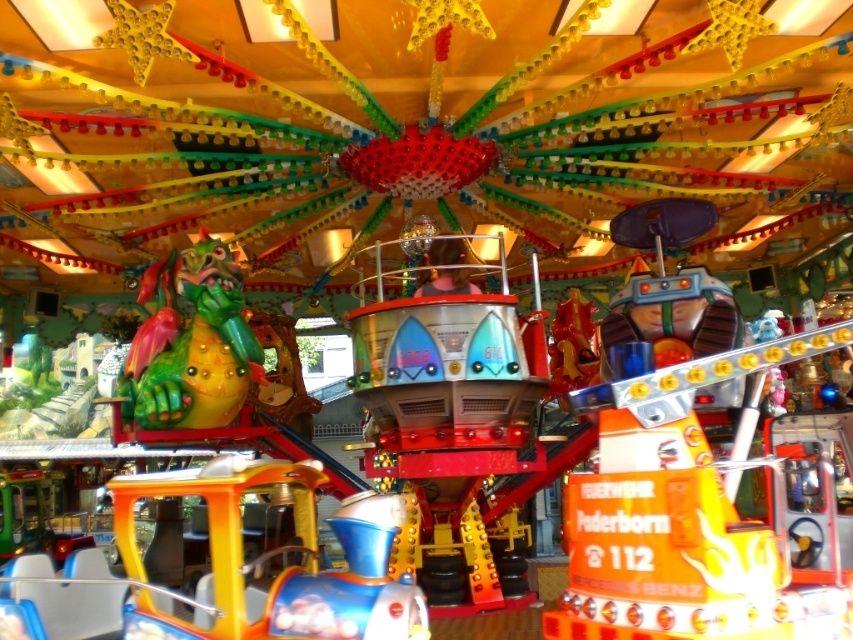
Can you confirm if metallic blue spaceship at center is bigger than green matte dragon at center?

Indeed, metallic blue spaceship at center has a larger size compared to green matte dragon at center.

Does point (416, 291) come farther from viewer compared to point (219, 276)?

No.

Is point (366, 467) less distant than point (202, 275)?

Yes, it is in front of point (202, 275).

This screenshot has width=853, height=640. Find the location of `metallic blue spaceship at center`. metallic blue spaceship at center is located at coordinates (448, 413).